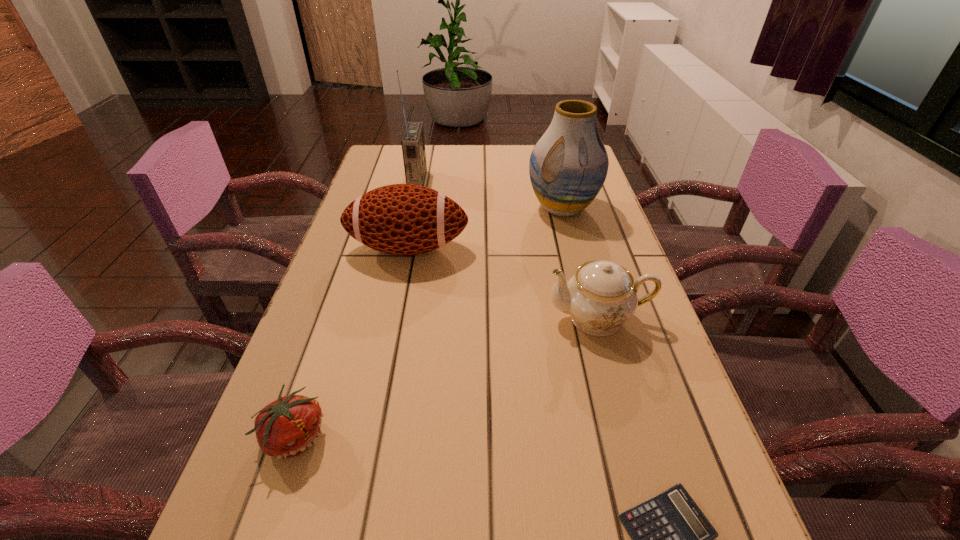
In order to click on object at the far left corner in this screenshot , I will do `click(413, 144)`.

Image resolution: width=960 pixels, height=540 pixels. Find the location of `free space at the far edge of the desktop`. free space at the far edge of the desktop is located at coordinates (479, 161).

This screenshot has width=960, height=540. In the image, there is a desktop. In order to click on vacant space at the left edge in this screenshot , I will do `click(376, 346)`.

Identify the location of vacant area at the right edge of the desktop. (579, 231).

Find the location of a particular element. vacant space at the far left corner of the desktop is located at coordinates pos(385,156).

This screenshot has width=960, height=540. I want to click on empty space between the radio receiver and the vase, so [490, 194].

Locate an element on the screen. The height and width of the screenshot is (540, 960). empty space between the radio receiver and the fourth tallest object is located at coordinates pos(508,249).

The height and width of the screenshot is (540, 960). What are the coordinates of `free space between the fourth tallest object and the tomato` in the screenshot? It's located at (447, 376).

Identify the location of object that ranks as the closest to the vase. The height and width of the screenshot is (540, 960). (400, 219).

Where is `object identified as the closest to the nearest object`? The image size is (960, 540). object identified as the closest to the nearest object is located at coordinates (602, 296).